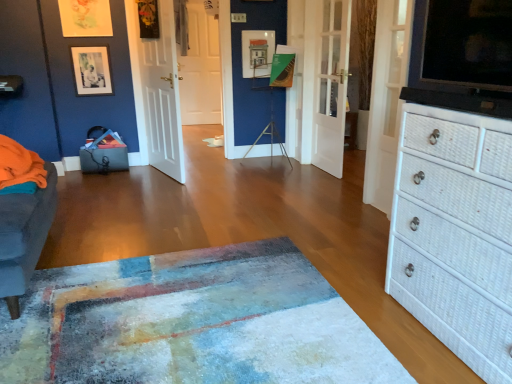
Where is `free location to the right of white wooden door at left, arranged as the 2th door when viewed from the front`? Image resolution: width=512 pixels, height=384 pixels. free location to the right of white wooden door at left, arranged as the 2th door when viewed from the front is located at coordinates (216, 176).